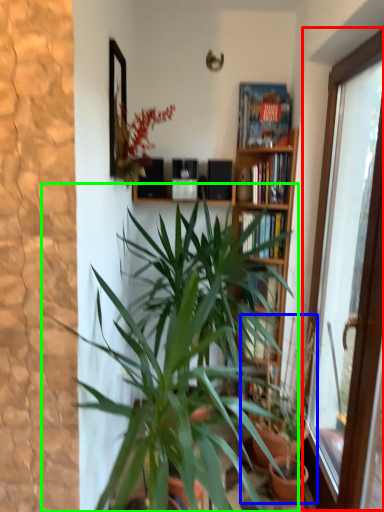
Question: Estimate the real-world distances between objects in this image. Which object is closer to window (highlighted by a red box), houseplant (highlighted by a blue box) or houseplant (highlighted by a green box)?

Choices:
 (A) houseplant
 (B) houseplant

Answer: (A)